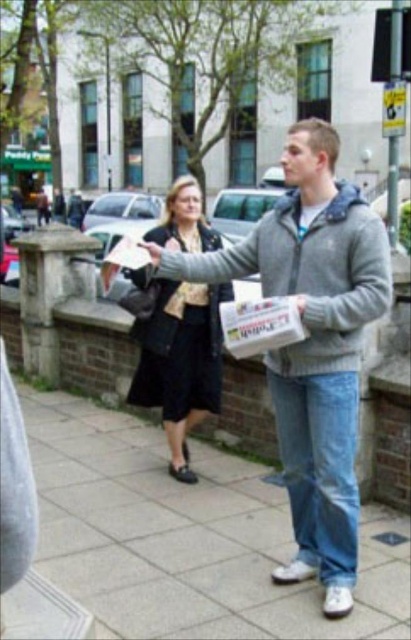
Question: Can you confirm if gray concrete pavement at center is positioned above gray fleece sweatshirt at center?

Choices:
 (A) no
 (B) yes

Answer: (A)

Question: Can you confirm if matte black jacket at center is positioned above matte black sweatshirt at center?

Choices:
 (A) yes
 (B) no

Answer: (B)

Question: Which of these objects is positioned closest to the matte black sweatshirt at center?

Choices:
 (A) matte plastic bag at lower left
 (B) gray concrete pavement at center
 (C) gray fleece jacket at center
 (D) gray fleece sweatshirt at center

Answer: (D)

Question: Among these objects, which one is nearest to the camera?

Choices:
 (A) matte black jacket at center
 (B) gray concrete pavement at center

Answer: (B)

Question: Does gray fleece jacket at center come behind matte plastic bag at lower left?

Choices:
 (A) yes
 (B) no

Answer: (A)

Question: Which point is closer to the camera taking this photo?

Choices:
 (A) (156, 310)
 (B) (182, 230)

Answer: (A)